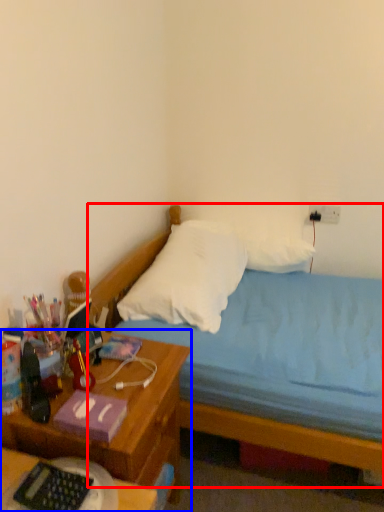
Question: Which object is closer to the camera taking this photo, bed (highlighted by a red box) or nightstand (highlighted by a blue box)?

Choices:
 (A) bed
 (B) nightstand

Answer: (B)